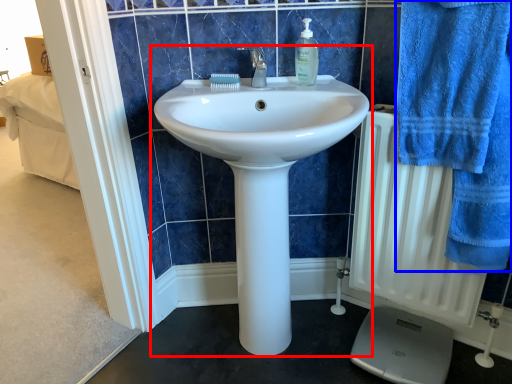
Question: Which of the following is the closest to the observer, sink (highlighted by a red box) or bath towel (highlighted by a blue box)?

Choices:
 (A) sink
 (B) bath towel

Answer: (B)